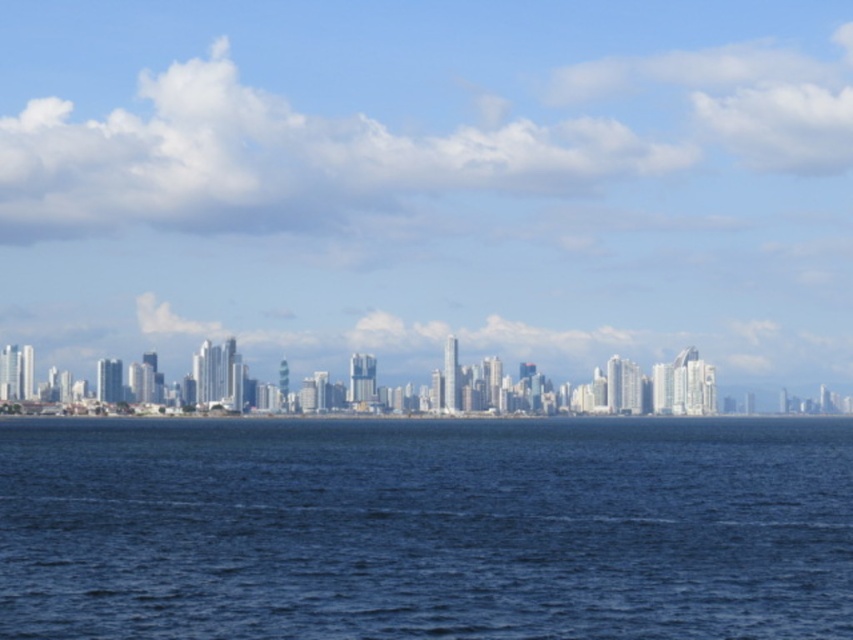
Is transparent glass skyscrapers at center taller than blue liquid water at center?

Yes.

Who is more forward, [315,268] or [212,486]?

Point [212,486] is more forward.

At what (x,y) coordinates should I click in order to perform the action: click on transparent glass skyscrapers at center. Please return your answer as a coordinate pair (x, y). Looking at the image, I should click on (430, 184).